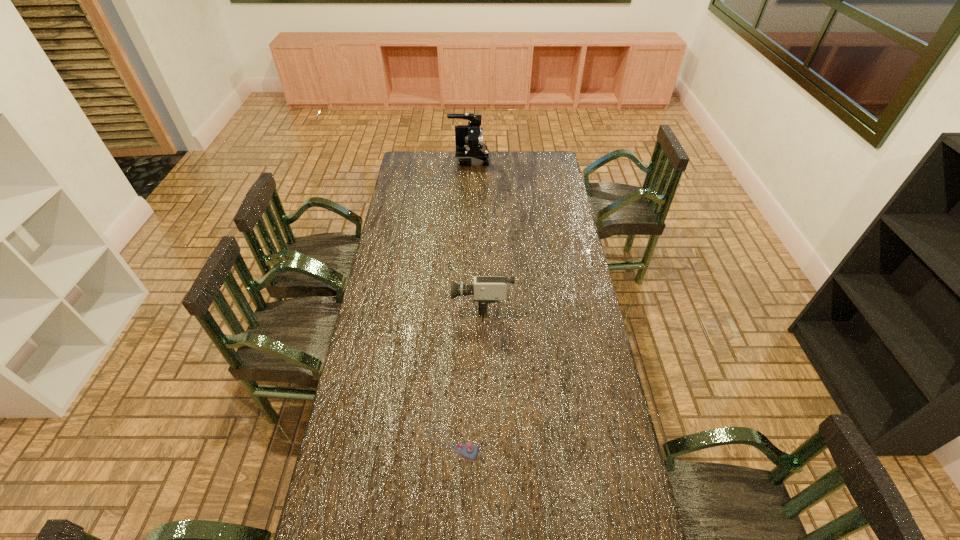
Where is `the farther camcorder`? The width and height of the screenshot is (960, 540). the farther camcorder is located at coordinates (470, 150).

At what (x,y) coordinates should I click in order to perform the action: click on the farthest object. Please return your answer as a coordinate pair (x, y). The image size is (960, 540). Looking at the image, I should click on (470, 150).

Identify the location of the shorter camcorder. (487, 289).

Where is `the nearer camcorder`? The height and width of the screenshot is (540, 960). the nearer camcorder is located at coordinates (487, 289).

The height and width of the screenshot is (540, 960). Identify the location of the shortest object. (469, 451).

The height and width of the screenshot is (540, 960). What are the coordinates of `the nearest object` in the screenshot? It's located at (469, 451).

I want to click on free space located 0.170m on the lens mount of the farther camcorder, so click(518, 160).

Where is `blank space located 0.310m on the recording direction of the second tallest object`? Image resolution: width=960 pixels, height=540 pixels. blank space located 0.310m on the recording direction of the second tallest object is located at coordinates (379, 301).

Where is `vacant area situated on the recording direction of the second tallest object`? This screenshot has height=540, width=960. vacant area situated on the recording direction of the second tallest object is located at coordinates (372, 301).

The image size is (960, 540). Find the location of `vacant space located 0.060m on the recording direction of the second tallest object`. vacant space located 0.060m on the recording direction of the second tallest object is located at coordinates (439, 301).